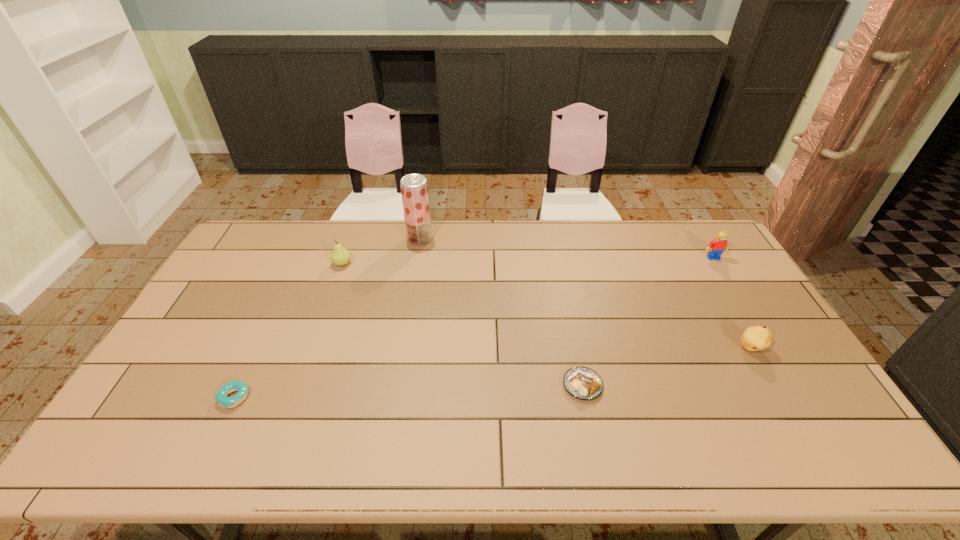
You are a GUI agent. You are given a task and a screenshot of the screen. Output one action in this format:
    pyautogui.click(x=<x>, y=<y>)
    Task: Click on the fruit juice
    The height and width of the screenshot is (540, 960).
    Given the screenshot: What is the action you would take?
    pyautogui.click(x=414, y=188)

Locate an element on the screen. This screenshot has height=540, width=960. the tallest object is located at coordinates (414, 188).

Where is `Lego`? Lego is located at coordinates (716, 247).

At what (x,y) coordinates should I click in order to perform the action: click on the left pear. Please return your answer as a coordinate pair (x, y). Looking at the image, I should click on (340, 256).

This screenshot has width=960, height=540. In order to click on the fifth object from right to left in this screenshot , I will do `click(340, 256)`.

The height and width of the screenshot is (540, 960). I want to click on the nearer pear, so click(x=755, y=338).

Identify the location of the fourth farthest object. This screenshot has width=960, height=540. (755, 338).

Where is `pastry`? pastry is located at coordinates (583, 383).

Locate an element on the screen. This screenshot has height=540, width=960. the fifth tallest object is located at coordinates (583, 383).

The image size is (960, 540). I want to click on the leftmost object, so click(221, 397).